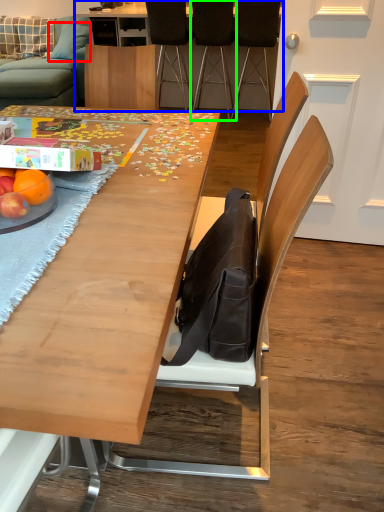
Question: Considering the real-world distances, which object is farthest from pillow (highlighted by a red box)? table (highlighted by a blue box) or chair (highlighted by a green box)?

Choices:
 (A) table
 (B) chair

Answer: (B)